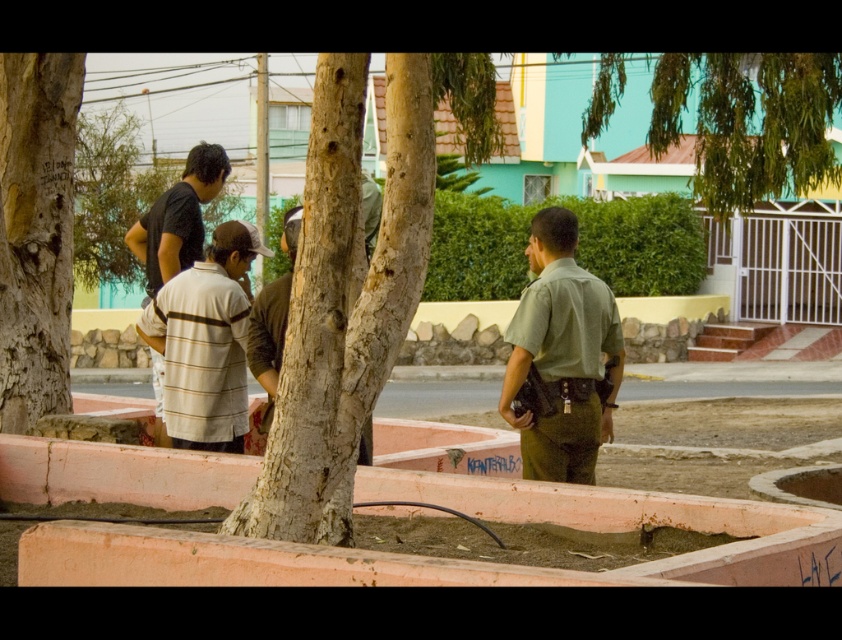
Does green uniform at center appear over brown textured shirt at center?

Indeed, green uniform at center is positioned over brown textured shirt at center.

Can you confirm if green uniform at center is taller than brown textured shirt at center?

No.

Which is in front, point (594, 422) or point (292, 224)?

Point (594, 422)

The height and width of the screenshot is (640, 842). I want to click on green uniform at center, so click(x=561, y=358).

Is green leafy tree at upper right shorter than brown textured shirt at center?

Yes.

This screenshot has width=842, height=640. Describe the element at coordinates (749, 122) in the screenshot. I see `green leafy tree at upper right` at that location.

I want to click on green leafy tree at upper right, so click(x=749, y=122).

This screenshot has width=842, height=640. What do you see at coordinates (749, 122) in the screenshot? I see `green leafy tree at upper right` at bounding box center [749, 122].

Does green leafy tree at upper right have a greater width compared to green uniform at center?

Indeed, green leafy tree at upper right has a greater width compared to green uniform at center.

Describe the element at coordinates (749, 122) in the screenshot. I see `green leafy tree at upper right` at that location.

You are a GUI agent. You are given a task and a screenshot of the screen. Output one action in this format:
    pyautogui.click(x=<x>, y=<y>)
    Task: Click on the green leafy tree at upper right
    Image resolution: width=842 pixels, height=640 pixels.
    Given the screenshot: What is the action you would take?
    pyautogui.click(x=749, y=122)